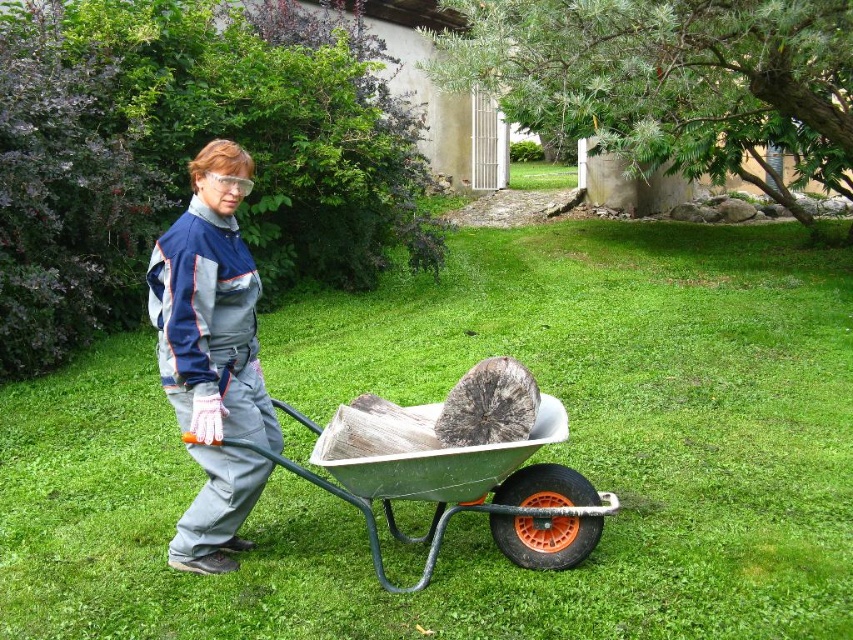
Between point (253, 397) and point (277, 403), which one is positioned in front?

Positioned in front is point (253, 397).

Is gray fabric jumpsuit at center positioned at the back of green metallic wheelbarrow at center?

No.

Which is behind, point (184, 406) or point (200, 449)?

The point (200, 449) is more distant.

Where is `gray fabric jumpsuit at center`? This screenshot has width=853, height=640. gray fabric jumpsuit at center is located at coordinates (212, 355).

Who is positioned more to the left, green grass at center or gray fabric jumpsuit at center?

gray fabric jumpsuit at center

Is green grass at center bigger than gray fabric jumpsuit at center?

Indeed, green grass at center has a larger size compared to gray fabric jumpsuit at center.

Is point (730, 516) positioned behind point (223, 420)?

Yes.

Identify the location of green grass at center. point(532,458).

Can you confirm if green grass at center is taller than green metallic wheelbarrow at center?

Yes.

Can you confirm if green grass at center is positioned below green metallic wheelbarrow at center?

No, green grass at center is not below green metallic wheelbarrow at center.

Which is behind, point (624, 417) or point (553, 522)?

The point (624, 417) is behind.

Locate an element on the screen. The height and width of the screenshot is (640, 853). green grass at center is located at coordinates (532, 458).